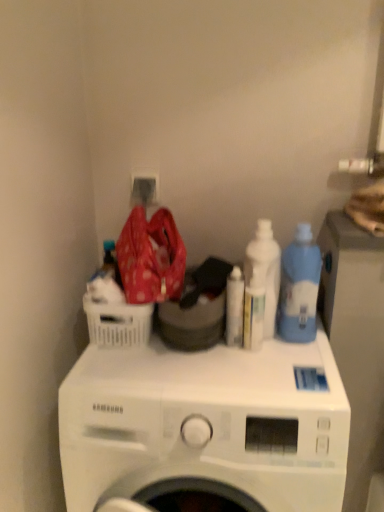
This screenshot has width=384, height=512. I want to click on free location to the right of white glossy bottle at center, the 1th cleaning product when ordered from left to right, so [294, 356].